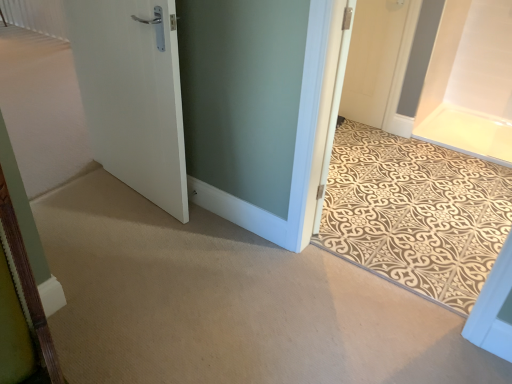
Question: Based on their positions, is white matte door at left, positioned as the second door in right-to-left order, located to the left or right of white matte door at upper right, marked as the 3th door in a left-to-right arrangement?

Choices:
 (A) left
 (B) right

Answer: (A)

Question: In terms of height, does white matte door at left, marked as the 1th door in a front-to-back arrangement, look taller or shorter compared to white matte door at upper right, acting as the 1th door starting from the back?

Choices:
 (A) tall
 (B) short

Answer: (A)

Question: Which object is positioned closest to the beige patterned mat at center?

Choices:
 (A) white matte door at upper right, marked as the 3th door in a left-to-right arrangement
 (B) white matte door at left, positioned as the second door in right-to-left order
 (C) white matte door at left, the 3th door from the right

Answer: (A)

Question: Estimate the real-world distances between objects in this image. Which object is farther from the white matte door at upper right, acting as the 1th door starting from the back?

Choices:
 (A) white matte door at left, positioned as the second door in right-to-left order
 (B) white matte door at left, the 2th door from the back
 (C) beige patterned mat at center

Answer: (A)